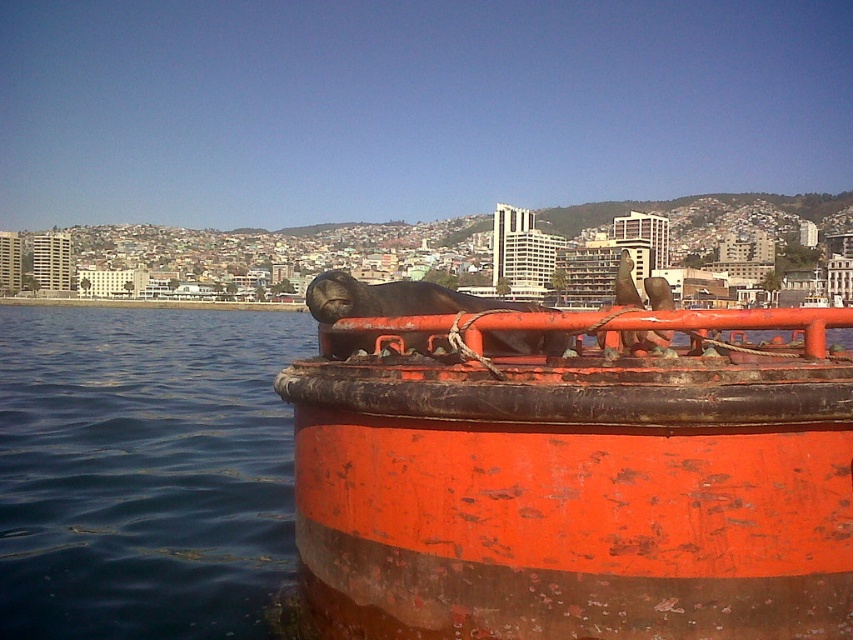
Question: Which of the following is the closest to the observer?

Choices:
 (A) rusty metal buoy at center
 (B) smooth orange rail at center
 (C) blue water at lower left

Answer: (A)

Question: Does rusty metal buoy at center appear over smooth orange rail at center?

Choices:
 (A) yes
 (B) no

Answer: (B)

Question: Is rusty metal buoy at center below smooth orange rail at center?

Choices:
 (A) yes
 (B) no

Answer: (A)

Question: Is blue water at lower left to the right of smooth orange rail at center from the viewer's perspective?

Choices:
 (A) yes
 (B) no

Answer: (B)

Question: Which object is positioned closest to the rusty metal buoy at center?

Choices:
 (A) smooth orange rail at center
 (B) blue water at lower left

Answer: (A)

Question: Among these points, which one is nearest to the camera?

Choices:
 (A) (178, 627)
 (B) (351, 317)
 (C) (596, 492)

Answer: (C)